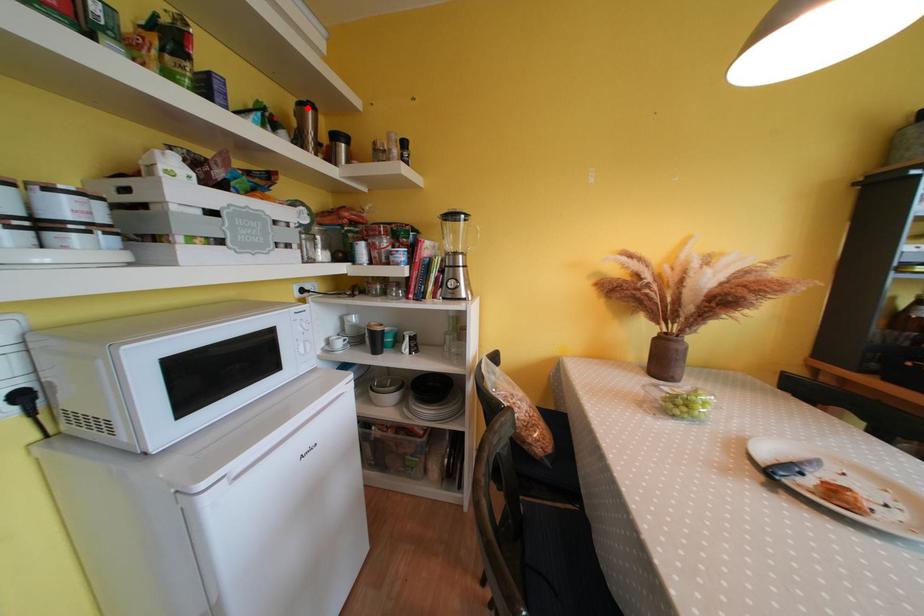
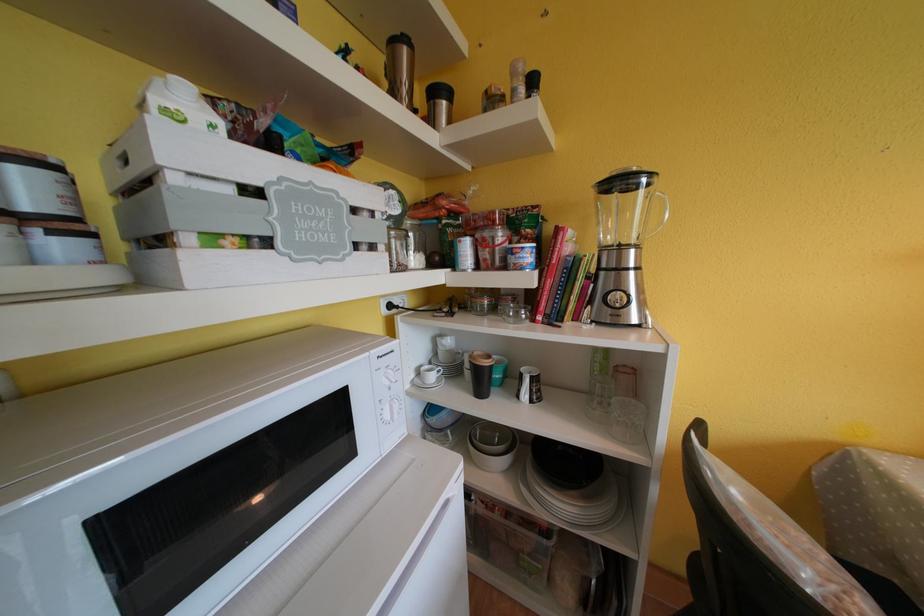
Find the pixel in the second image that matches the highlighted location in the first image.

(399, 46)